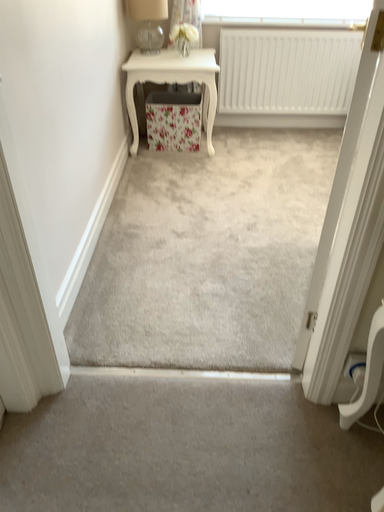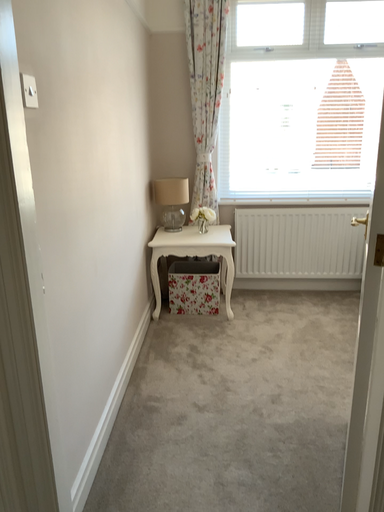
Question: How did the camera likely rotate when shooting the video?

Choices:
 (A) rotated downward
 (B) rotated upward

Answer: (B)